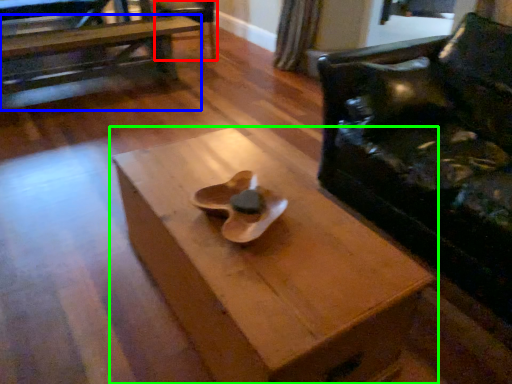
Question: Which object is positioned farthest from armchair (highlighted by a red box)? Select from table (highlighted by a blue box) and table (highlighted by a green box).

Choices:
 (A) table
 (B) table

Answer: (B)